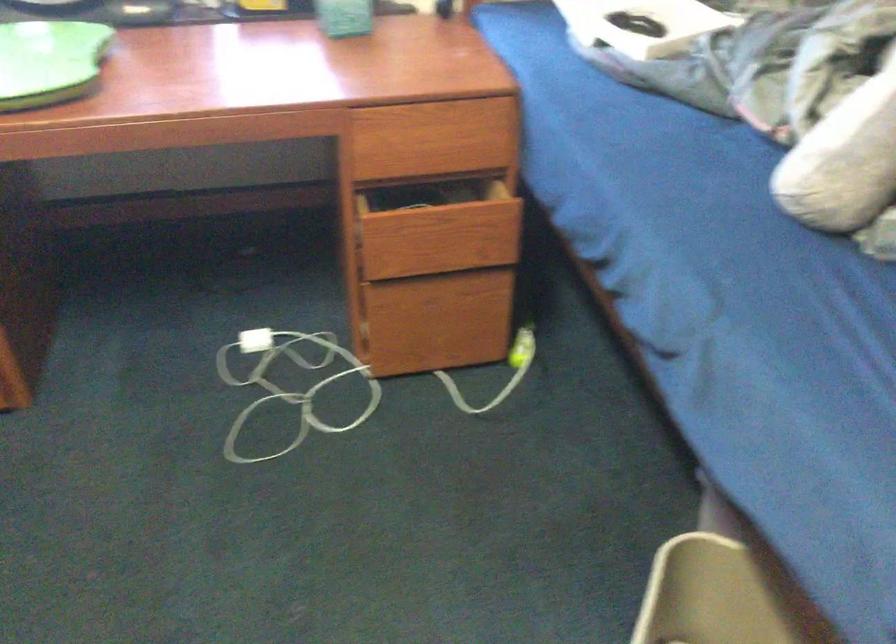
Find where to lift the green lap desk. Please return your answer as a coordinate pair (x, y).

(49, 62)